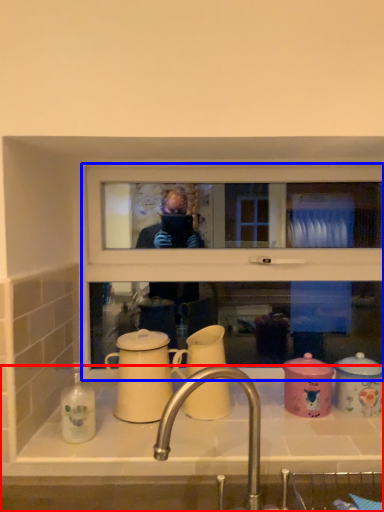
Question: Which of the following is the closest to the observer, sink (highlighted by a red box) or window frame (highlighted by a blue box)?

Choices:
 (A) sink
 (B) window frame

Answer: (A)